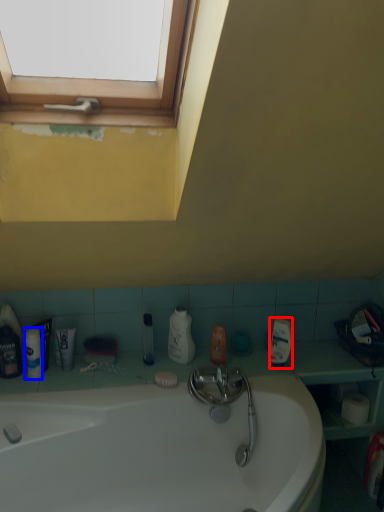
Question: Among these objects, which one is nearest to the camera, cleaning product (highlighted by a red box) or toiletry (highlighted by a blue box)?

Choices:
 (A) cleaning product
 (B) toiletry

Answer: (B)